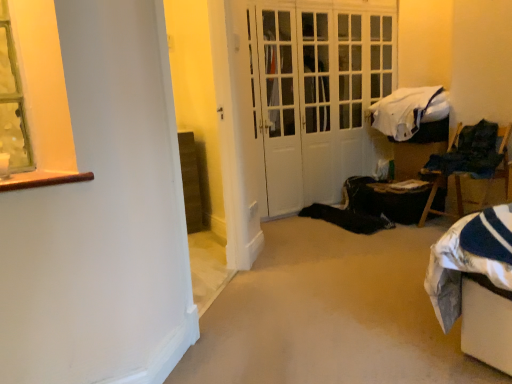
Question: Is black fabric bag at lower right at the back of wooden chair at right?

Choices:
 (A) yes
 (B) no

Answer: (B)

Question: Does wooden chair at right come in front of black fabric bag at lower right?

Choices:
 (A) yes
 (B) no

Answer: (A)

Question: Is wooden chair at right aimed at black fabric bag at lower right?

Choices:
 (A) yes
 (B) no

Answer: (B)

Question: Considering the relative sizes of wooden chair at right and black fabric bag at lower right in the image provided, is wooden chair at right thinner than black fabric bag at lower right?

Choices:
 (A) no
 (B) yes

Answer: (B)

Question: Can you confirm if wooden chair at right is wider than black fabric bag at lower right?

Choices:
 (A) no
 (B) yes

Answer: (A)

Question: Considering the positions of white glossy door at center and wooden chair at right in the image, is white glossy door at center taller or shorter than wooden chair at right?

Choices:
 (A) short
 (B) tall

Answer: (B)

Question: In the image, is white glossy door at center on the left side or the right side of wooden chair at right?

Choices:
 (A) right
 (B) left

Answer: (B)

Question: Is point (294, 135) closer or farther from the camera than point (458, 198)?

Choices:
 (A) farther
 (B) closer

Answer: (A)

Question: From the image's perspective, relative to wooden chair at right, is white glossy door at center above or below?

Choices:
 (A) above
 (B) below

Answer: (A)

Question: In terms of width, does black fabric bag at lower right look wider or thinner when compared to white soft blanket at upper right?

Choices:
 (A) wide
 (B) thin

Answer: (A)

Question: From their relative heights in the image, would you say black fabric bag at lower right is taller or shorter than white soft blanket at upper right?

Choices:
 (A) tall
 (B) short

Answer: (B)

Question: Is black fabric bag at lower right inside or outside of white soft blanket at upper right?

Choices:
 (A) outside
 (B) inside

Answer: (A)

Question: Considering the relative positions of black fabric bag at lower right and white soft blanket at upper right in the image provided, is black fabric bag at lower right to the left or to the right of white soft blanket at upper right?

Choices:
 (A) right
 (B) left

Answer: (B)

Question: Is black fabric bag at lower right to the left or to the right of white glossy door at center in the image?

Choices:
 (A) right
 (B) left

Answer: (A)

Question: Looking at their shapes, would you say black fabric bag at lower right is wider or thinner than white glossy door at center?

Choices:
 (A) wide
 (B) thin

Answer: (B)